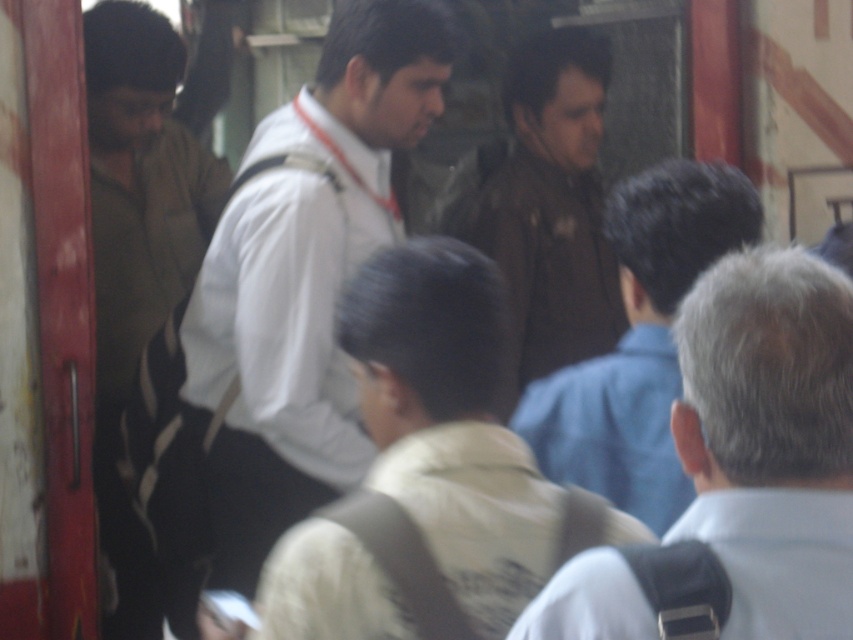
You are standing in a crowded indoor space and see the beige fabric vest at center and the brown leather jacket at upper center. Which one is positioned lower in the image?

The beige fabric vest at center is located below the brown leather jacket at upper center, so the beige fabric vest at center is positioned lower in the image.

You are a photographer standing at the camera position. You want to take a clear photo of the white shirt at center. What is the minimum distance you need to move forward to ensure the subject is in focus?

The white shirt at center is currently 2.86 meters away from the camera. To ensure the subject is in focus, you need to move forward so that the distance between you and the white shirt at center is within the camera focus range. However, without knowing the camera focus range, it is impossible to determine the exact distance to move.